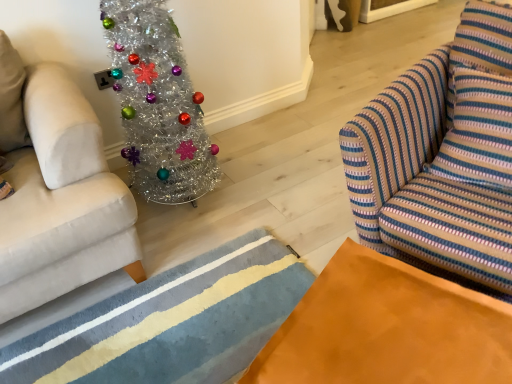
At what (x,y) coordinates should I click in order to perform the action: click on vacant region in front of shiny silver christmas tree at left. Please return your answer as a coordinate pair (x, y). This screenshot has height=384, width=512. Looking at the image, I should click on (190, 246).